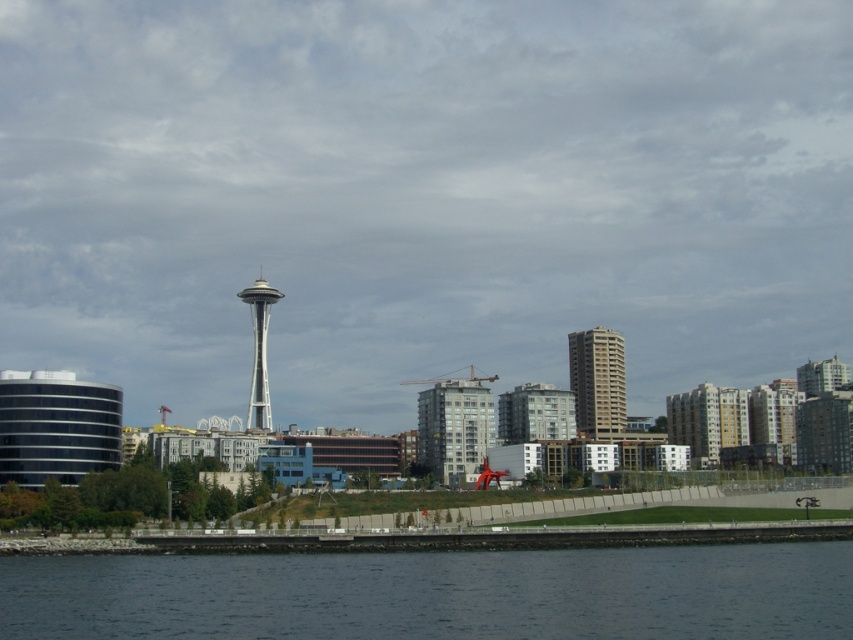
Between dark blue water at lower center and silver metallic space needle at center, which one appears on the left side from the viewer's perspective?

silver metallic space needle at center

Who is more distant from viewer, (163, 563) or (263, 352)?

Positioned behind is point (263, 352).

In order to click on dark blue water at lower center in this screenshot , I will do `click(437, 593)`.

How much distance is there between beige concrete building at center and silver metallic space needle at center?

beige concrete building at center is 169.29 feet from silver metallic space needle at center.

Which is more to the left, beige concrete building at center or silver metallic space needle at center?

silver metallic space needle at center

Between point (590, 352) and point (258, 380), which one is positioned behind?

Point (590, 352)

I want to click on beige concrete building at center, so click(596, 380).

Does dark blue water at lower center lie behind beige concrete building at center?

That is False.

Who is positioned more to the right, dark blue water at lower center or beige concrete building at center?

Positioned to the right is beige concrete building at center.

Identify the location of dark blue water at lower center. The height and width of the screenshot is (640, 853). (437, 593).

Find the location of a particular element. dark blue water at lower center is located at coordinates (437, 593).